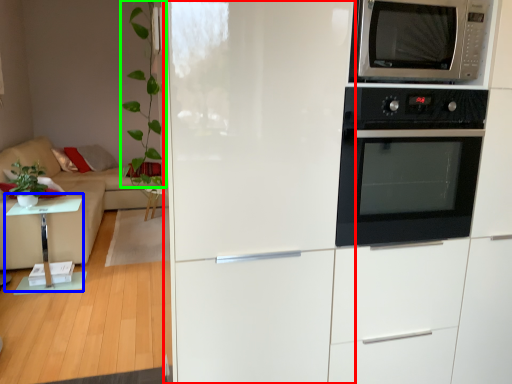
Question: Which is farther away from fridge (highlighted by a red box)? table (highlighted by a blue box) or plant (highlighted by a green box)?

Choices:
 (A) table
 (B) plant

Answer: (A)